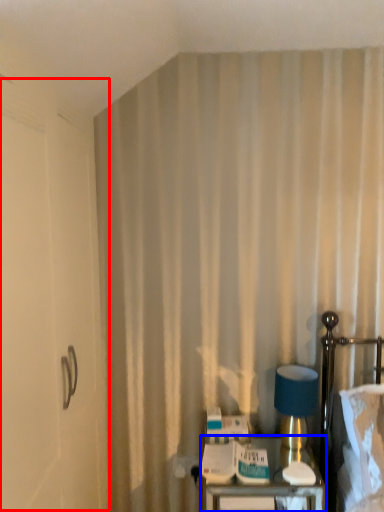
Question: Among these objects, which one is nearest to the camera, screen door (highlighted by a red box) or furniture (highlighted by a blue box)?

Choices:
 (A) screen door
 (B) furniture

Answer: (A)